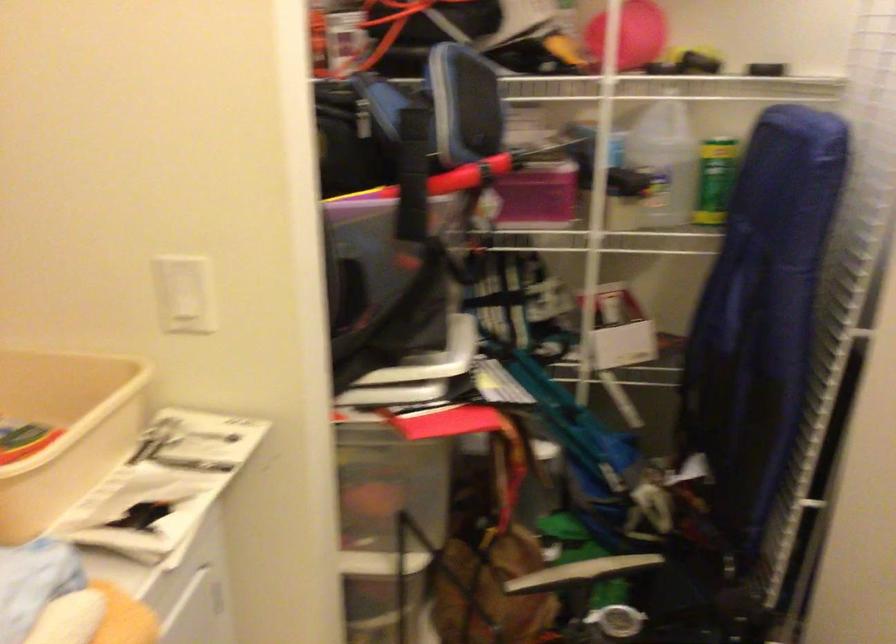
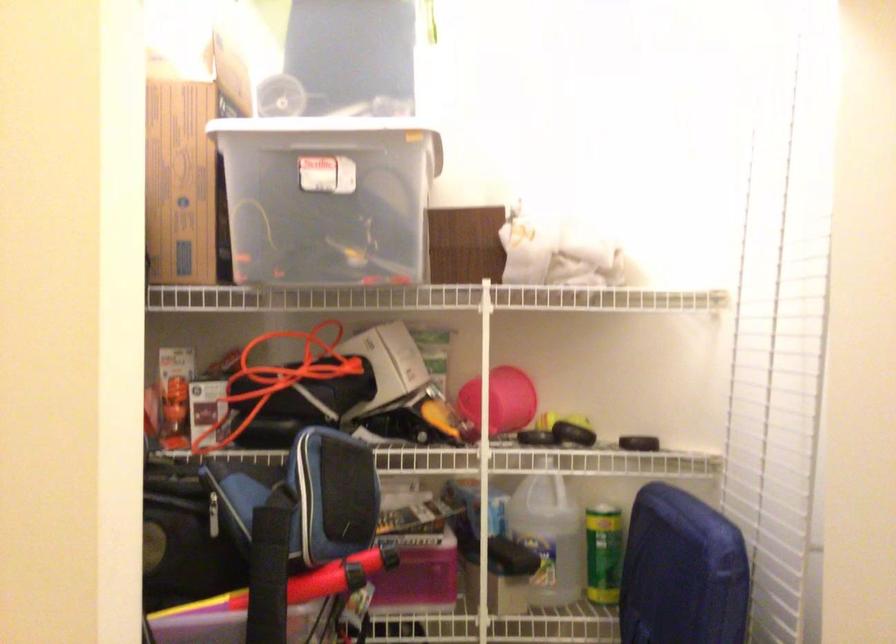
Find the pixel in the second image that matches the point at 786,166 in the first image.

(682, 572)